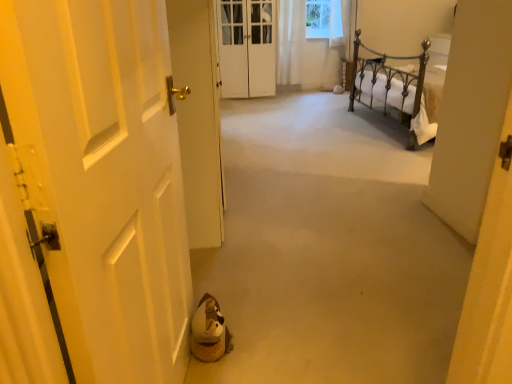
Question: Is beige carpet at center wider than white glossy door at left, the second door in the front-to-back sequence?

Choices:
 (A) yes
 (B) no

Answer: (A)

Question: Can you confirm if beige carpet at center is taller than white glossy door at left, positioned as the second door in back-to-front order?

Choices:
 (A) yes
 (B) no

Answer: (B)

Question: Is beige carpet at center facing towards white glossy door at left, positioned as the second door in back-to-front order?

Choices:
 (A) no
 (B) yes

Answer: (A)

Question: Can we say beige carpet at center lies outside white glossy door at left, the second door in the front-to-back sequence?

Choices:
 (A) no
 (B) yes

Answer: (B)

Question: Does beige carpet at center come behind white glossy door at left, the second door in the front-to-back sequence?

Choices:
 (A) no
 (B) yes

Answer: (A)

Question: Is beige carpet at center to the left of white glossy door at left, positioned as the second door in back-to-front order, from the viewer's perspective?

Choices:
 (A) yes
 (B) no

Answer: (B)

Question: Can you confirm if white glossy door at left, positioned as the second door in back-to-front order, is positioned to the right of beige carpet at center?

Choices:
 (A) yes
 (B) no

Answer: (B)

Question: Does white glossy door at left, the second door in the front-to-back sequence, have a greater width compared to beige carpet at center?

Choices:
 (A) yes
 (B) no

Answer: (B)

Question: Is white glossy door at left, positioned as the second door in back-to-front order, in front of beige carpet at center?

Choices:
 (A) no
 (B) yes

Answer: (A)

Question: Is white glossy door at left, positioned as the second door in back-to-front order, completely or partially outside of beige carpet at center?

Choices:
 (A) yes
 (B) no

Answer: (A)

Question: Is white glossy door at left, positioned as the second door in back-to-front order, touching beige carpet at center?

Choices:
 (A) yes
 (B) no

Answer: (B)

Question: Is white glossy door at left, positioned as the second door in back-to-front order, not close to beige carpet at center?

Choices:
 (A) yes
 (B) no

Answer: (B)

Question: Is white glossy door at left, the second door in the front-to-back sequence, to the left of white matte door at left, which appears as the 3th door when viewed from the back, from the viewer's perspective?

Choices:
 (A) no
 (B) yes

Answer: (B)